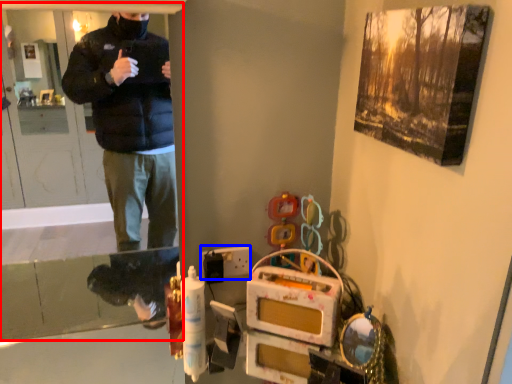
Question: Among these objects, which one is nearest to the camera, screen door (highlighted by a red box) or switch (highlighted by a blue box)?

Choices:
 (A) screen door
 (B) switch

Answer: (A)